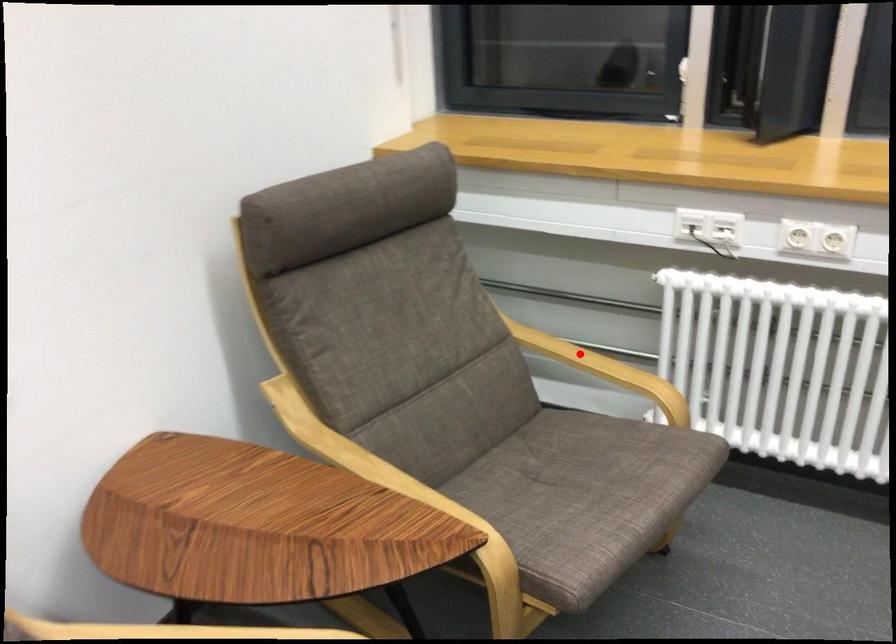
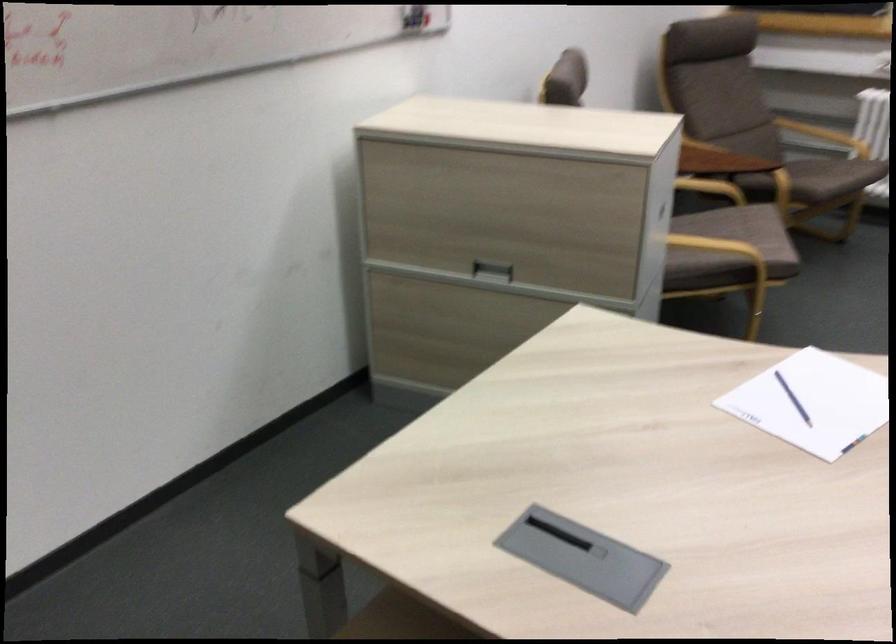
The point at the highlighted location is marked in the first image. Where is the corresponding point in the second image?

(824, 136)